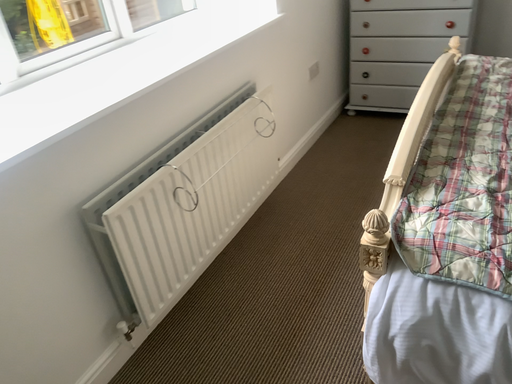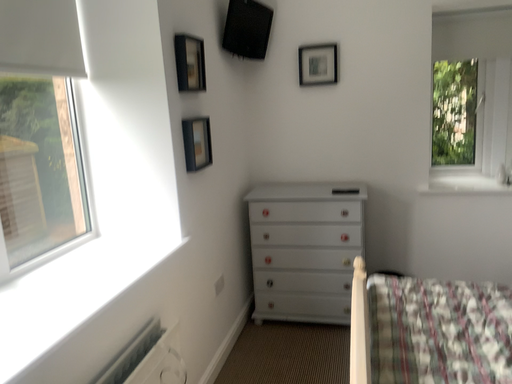
Question: Which way did the camera rotate in the video?

Choices:
 (A) rotated upward
 (B) rotated downward

Answer: (A)